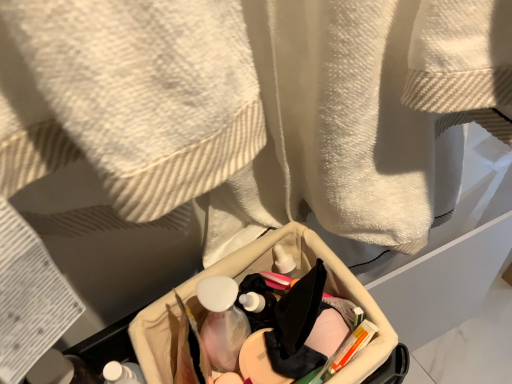
Question: Does translucent plastic mouthwash at center appear on the right side of white matte bottle at lower left?

Choices:
 (A) no
 (B) yes

Answer: (B)

Question: From the image's perspective, is translucent plastic mouthwash at center located beneath white matte bottle at lower left?

Choices:
 (A) yes
 (B) no

Answer: (B)

Question: From a real-world perspective, does translucent plastic mouthwash at center stand above white matte bottle at lower left?

Choices:
 (A) yes
 (B) no

Answer: (B)

Question: From the image's perspective, does translucent plastic mouthwash at center appear higher than white matte bottle at lower left?

Choices:
 (A) yes
 (B) no

Answer: (A)

Question: Can you see translucent plastic mouthwash at center touching white matte bottle at lower left?

Choices:
 (A) no
 (B) yes

Answer: (B)

Question: Is point (343, 374) positioned closer to the camera than point (120, 365)?

Choices:
 (A) farther
 (B) closer

Answer: (B)

Question: In the image, is beige fabric basket at center positioned in front of or behind white matte bottle at lower left?

Choices:
 (A) behind
 (B) front

Answer: (A)

Question: From a real-world perspective, is beige fabric basket at center physically located above or below white matte bottle at lower left?

Choices:
 (A) above
 (B) below

Answer: (B)

Question: From the image's perspective, relative to white matte bottle at lower left, is beige fabric basket at center above or below?

Choices:
 (A) below
 (B) above

Answer: (B)

Question: Is white matte bottle at lower left inside the boundaries of translucent plastic mouthwash at center, or outside?

Choices:
 (A) inside
 (B) outside

Answer: (B)

Question: Is white matte bottle at lower left in front of or behind translucent plastic mouthwash at center in the image?

Choices:
 (A) behind
 (B) front

Answer: (B)

Question: Is white matte bottle at lower left bigger or smaller than translucent plastic mouthwash at center?

Choices:
 (A) small
 (B) big

Answer: (B)

Question: Does point (140, 377) appear closer or farther from the camera than point (217, 329)?

Choices:
 (A) closer
 (B) farther

Answer: (A)

Question: From their relative heights in the image, would you say translucent plastic mouthwash at center is taller or shorter than beige fabric basket at center?

Choices:
 (A) short
 (B) tall

Answer: (B)

Question: Would you say translucent plastic mouthwash at center is to the left or to the right of beige fabric basket at center in the picture?

Choices:
 (A) left
 (B) right

Answer: (A)